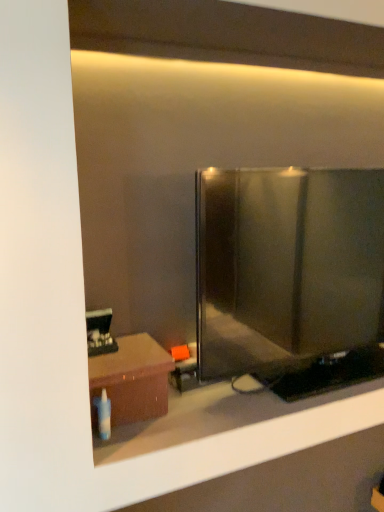
You are a GUI agent. You are given a task and a screenshot of the screen. Output one action in this format:
    pyautogui.click(x=<x>, y=<y>)
    Task: Click on the vacant area in front of brown matte table at lower left
    
    Given the screenshot: What is the action you would take?
    pyautogui.click(x=135, y=444)